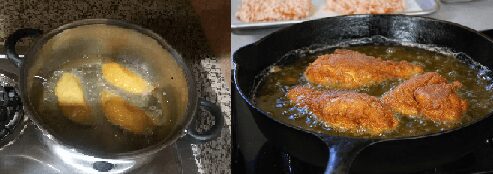
Where is `range`? Image resolution: width=493 pixels, height=174 pixels. range is located at coordinates (31, 140), (254, 156).